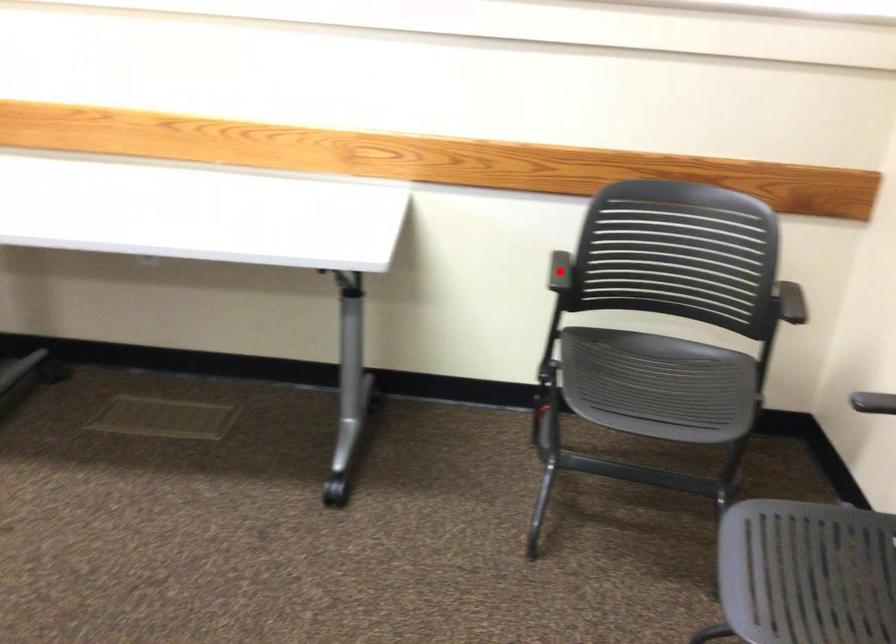
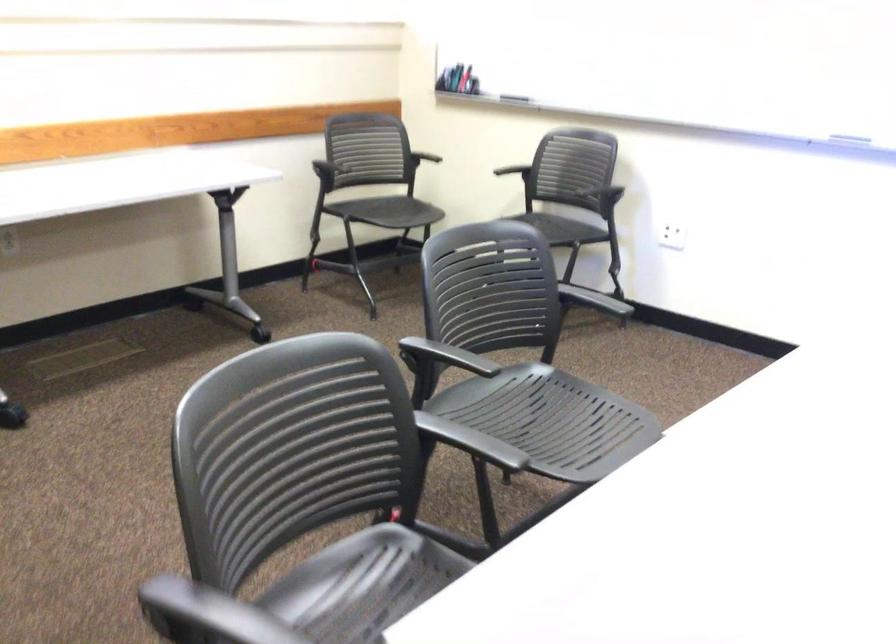
The point at the highlighted location is marked in the first image. Where is the corresponding point in the second image?

(340, 158)